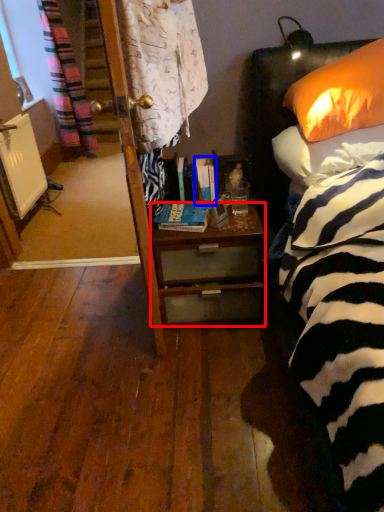
Question: Which of the following is the closest to the observer, desk (highlighted by a red box) or book (highlighted by a blue box)?

Choices:
 (A) desk
 (B) book

Answer: (A)